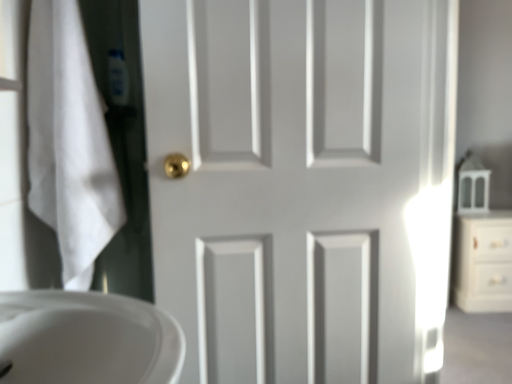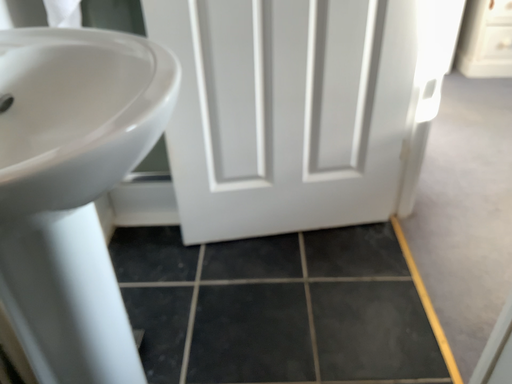
Question: Which way did the camera rotate in the video?

Choices:
 (A) rotated downward
 (B) rotated upward

Answer: (A)